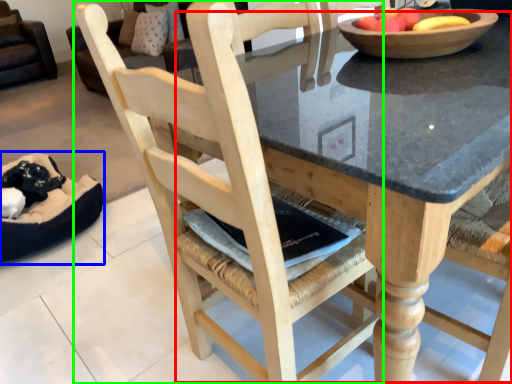
Question: Considering the real-world distances, which object is farthest from round table (highlighted by a red box)? bean bag chair (highlighted by a blue box) or chair (highlighted by a green box)?

Choices:
 (A) bean bag chair
 (B) chair

Answer: (A)